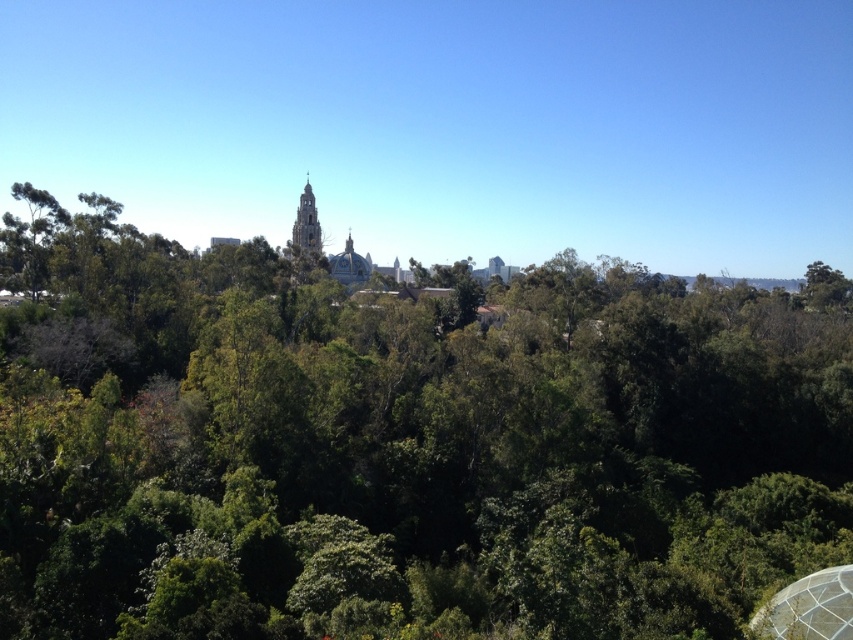
Does green leafy forest at center have a smaller size compared to green leafy tree at left?

No, green leafy forest at center is not smaller than green leafy tree at left.

Is point (463, 444) positioned after point (48, 243)?

No, it is not.

Is point (100, 307) behind point (19, 193)?

That is True.

Identify the location of green leafy forest at center. The height and width of the screenshot is (640, 853). (409, 448).